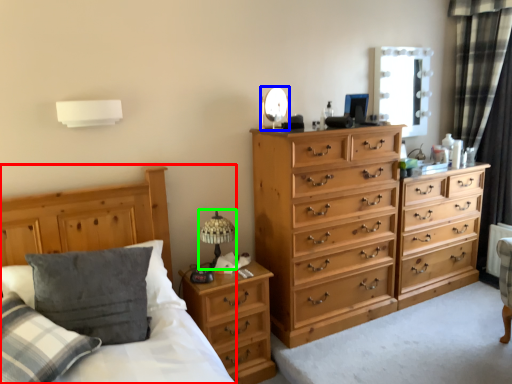
Question: Which object is the closest to the bed frame (highlighted by a red box)? Choose among these: mirror (highlighted by a blue box) or table lamp (highlighted by a green box).

Choices:
 (A) mirror
 (B) table lamp

Answer: (B)